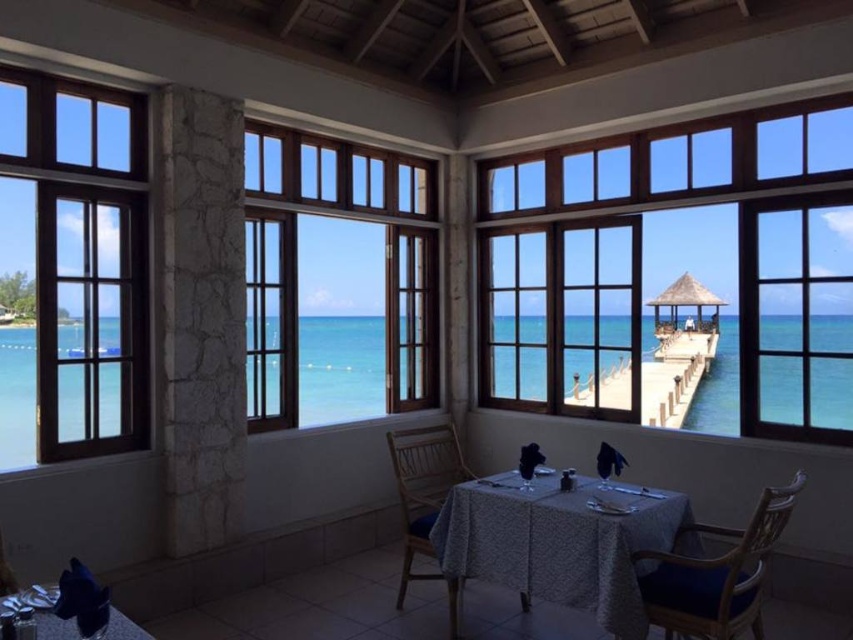
You are planning to place a large painting that is 2 meters wide on the wall. You have two options for placement areas in the dining area shown in the image. One area is near the clear glass window at left, and the other is near the wooden chair at center. Based on the available space, which area would be more suitable for the painting?

The clear glass window at left has a larger width than the wooden chair at center, so the area near the clear glass window at left would be more suitable for placing the large painting that is 2 meters wide.

You are sitting in the wooden chair at center and want to look out the clear glass window at left. Can you see the window without moving your head?

Yes, because the clear glass window at left is in front of the wooden chair at center, so you can see it directly in front of you.